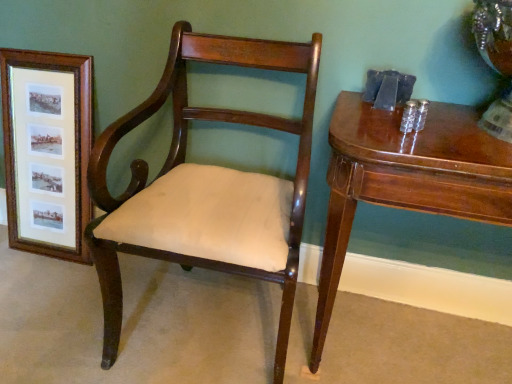
Question: Is wooden framed prints at left smaller than mahogany wood chair at center?

Choices:
 (A) no
 (B) yes

Answer: (B)

Question: From a real-world perspective, is wooden framed prints at left on mahogany wood chair at center?

Choices:
 (A) yes
 (B) no

Answer: (B)

Question: Is wooden framed prints at left to the left of mahogany wood chair at center from the viewer's perspective?

Choices:
 (A) yes
 (B) no

Answer: (A)

Question: Can you confirm if wooden framed prints at left is taller than mahogany wood chair at center?

Choices:
 (A) no
 (B) yes

Answer: (A)

Question: Considering the relative sizes of wooden framed prints at left and mahogany wood chair at center in the image provided, is wooden framed prints at left bigger than mahogany wood chair at center?

Choices:
 (A) yes
 (B) no

Answer: (B)

Question: From the image's perspective, is mahogany wood chair at center located above or below wooden framed prints at left?

Choices:
 (A) below
 (B) above

Answer: (A)

Question: Considering their positions, is mahogany wood chair at center located in front of or behind wooden framed prints at left?

Choices:
 (A) behind
 (B) front

Answer: (B)

Question: Looking at the image, does mahogany wood chair at center seem bigger or smaller compared to wooden framed prints at left?

Choices:
 (A) small
 (B) big

Answer: (B)

Question: Considering the relative positions of mahogany wood chair at center and wooden framed prints at left in the image provided, is mahogany wood chair at center to the left or to the right of wooden framed prints at left?

Choices:
 (A) right
 (B) left

Answer: (A)

Question: In terms of width, does wooden framed prints at left look wider or thinner when compared to glossy wood table at right?

Choices:
 (A) wide
 (B) thin

Answer: (B)

Question: From their relative heights in the image, would you say wooden framed prints at left is taller or shorter than glossy wood table at right?

Choices:
 (A) tall
 (B) short

Answer: (A)

Question: Do you think wooden framed prints at left is within glossy wood table at right, or outside of it?

Choices:
 (A) inside
 (B) outside

Answer: (B)

Question: In the image, is wooden framed prints at left on the left side or the right side of glossy wood table at right?

Choices:
 (A) left
 (B) right

Answer: (A)

Question: Is point (453, 183) positioned closer to the camera than point (37, 92)?

Choices:
 (A) closer
 (B) farther

Answer: (A)

Question: Considering the positions of glossy wood table at right and wooden framed prints at left in the image, is glossy wood table at right taller or shorter than wooden framed prints at left?

Choices:
 (A) short
 (B) tall

Answer: (A)